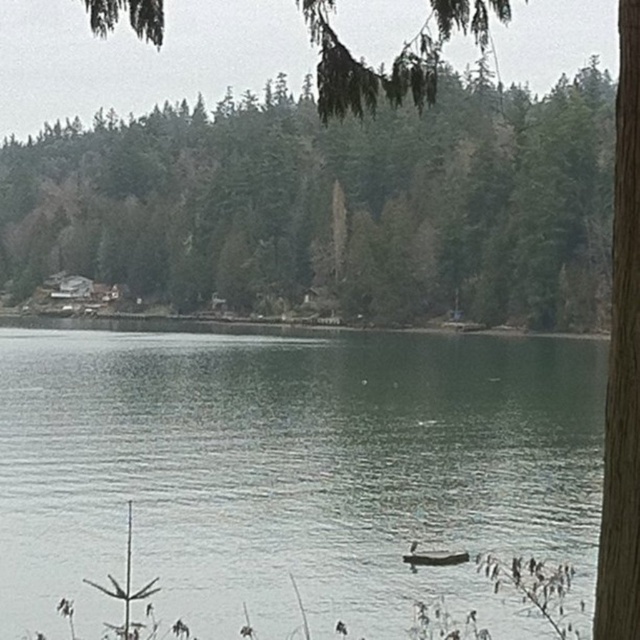
In the scene shown: Can you confirm if green smooth water at center is positioned to the left of green leafy tree at upper center?

Yes, green smooth water at center is to the left of green leafy tree at upper center.

Is point (58, 474) positioned in front of point (333, 104)?

No, it is not.

The image size is (640, 640). Find the location of `green smooth water at center`. green smooth water at center is located at coordinates (292, 472).

Consider the image. Can you confirm if green matte tree at center is positioned below green leafy tree at upper center?

Yes.

Which is in front, point (378, 198) or point (372, 76)?

Point (372, 76) is more forward.

This screenshot has height=640, width=640. In order to click on green matte tree at center in this screenshot , I will do `click(328, 208)`.

Which is more to the right, green smooth water at center or green matte tree at center?

Positioned to the right is green smooth water at center.

Based on the photo, measure the distance between green smooth water at center and green matte tree at center.

green smooth water at center and green matte tree at center are 52.68 meters apart from each other.

Between point (113, 448) and point (84, 202), which one is positioned in front?

Point (113, 448) is more forward.

You are a GUI agent. You are given a task and a screenshot of the screen. Output one action in this format:
    pyautogui.click(x=<x>, y=<y>)
    Task: Click on the green smooth water at center
    The height and width of the screenshot is (640, 640).
    Given the screenshot: What is the action you would take?
    pyautogui.click(x=292, y=472)